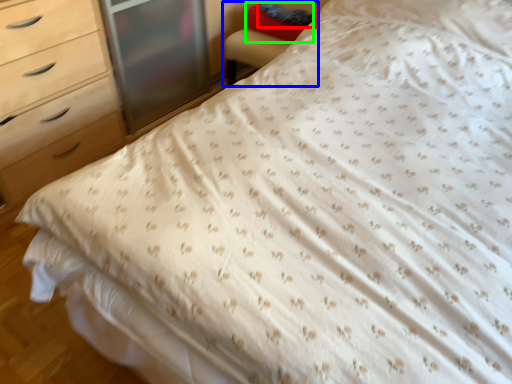
Question: Which object is positioned closest to pillow (highlighted by a red box)? Select from armchair (highlighted by a blue box) and pillow (highlighted by a green box).

Choices:
 (A) armchair
 (B) pillow

Answer: (B)